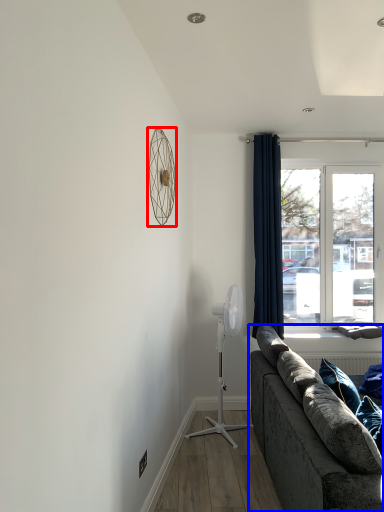
Question: Which of the following is the farthest to the observer, mechanical fan (highlighted by a red box) or studio couch (highlighted by a blue box)?

Choices:
 (A) mechanical fan
 (B) studio couch

Answer: (A)